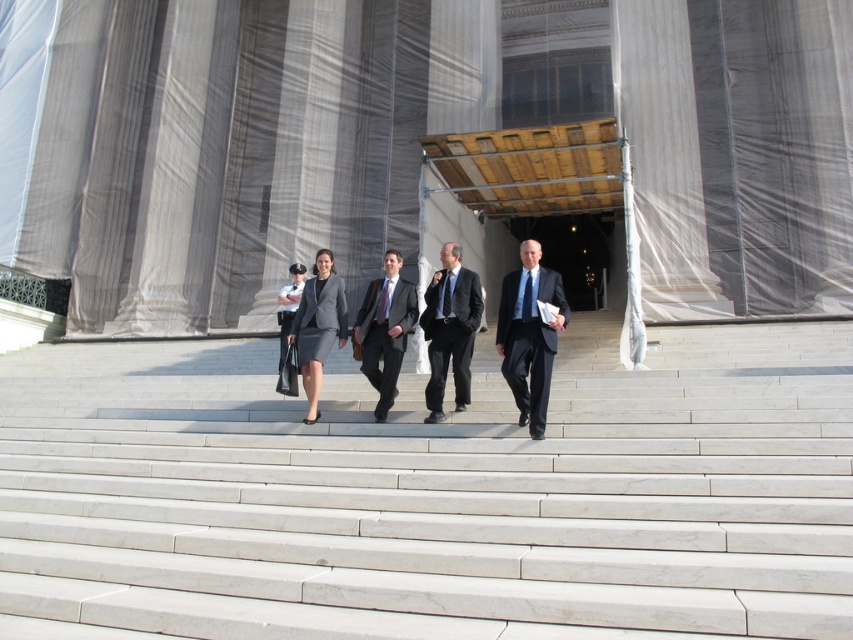
You are a photographer standing at the bottom of the stone steps. You want to take a photo of both the dark blue suit at center and the matte gray suit at center in the same frame. Given that your camera has a maximum focus range of 6 feet, will you be able to capture both subjects clearly in one shot?

The dark blue suit at center and the matte gray suit at center are 6.10 feet apart from each other. Since the camera can only focus up to 6 feet, the distance between them exceeds the focus range. Therefore, you cannot capture both clearly in one shot.

You are a photographer positioned at the bottom of the stone steps. You want to capture a photo of the dark blue suit at center and the matte black suit at center such that both are clearly visible. Given their positions, which suit should you focus on first to ensure the other remains in the frame?

The dark blue suit at center is in front of the matte black suit at center, so you should focus on the matte black suit at center first to ensure the dark blue suit at center stays visible behind it.

You are a photographer positioned at the bottom of the stone steps. You want to capture a photo of the dark gray suit at center and the matte gray dress at center without any people in between them. Is there enough space between them to ensure they are both clearly visible in the frame?

The dark gray suit at center is 1.07 meters away from the matte gray dress at center. Since there is a measurable distance between them, the photographer can capture both subjects clearly without any obstruction, as the space allows for a clear frame.